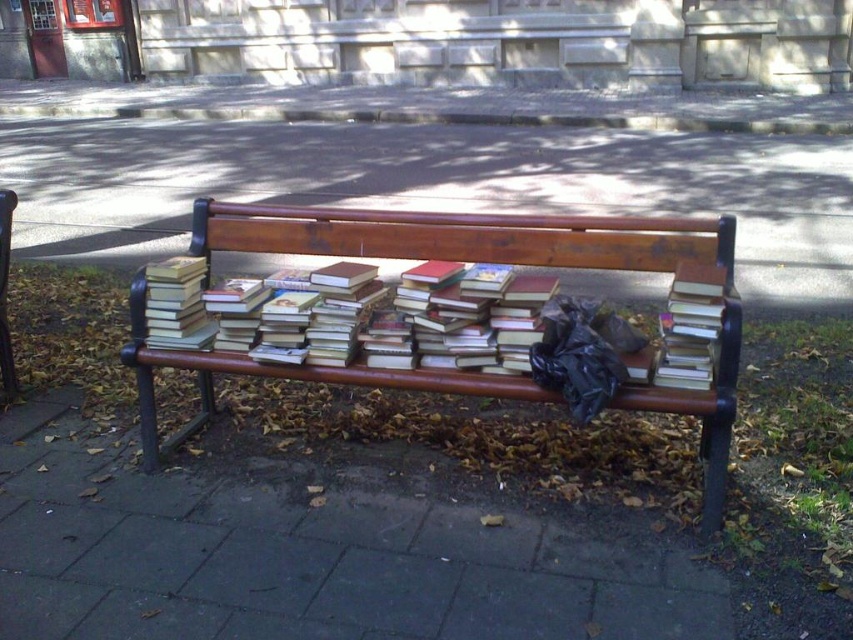
Which is above, brown wooden bench at center or wooden bench at center?

brown wooden bench at center is higher up.

Who is more forward, (643, 163) or (720, 392)?

Point (720, 392)

Locate an element on the screen. brown wooden bench at center is located at coordinates (434, 186).

Does hardcover books at center appear over hardcover book at center?

Yes.

Which is more to the left, hardcover books at center or hardcover book at center?

Positioned to the left is hardcover books at center.

Which is behind, point (274, 316) or point (695, 362)?

The point (274, 316) is more distant.

Where is `hardcover books at center`? hardcover books at center is located at coordinates (357, 316).

Between brown wooden bench at center and hardcover book at center, which one appears on the left side from the viewer's perspective?

brown wooden bench at center is more to the left.

Between brown wooden bench at center and hardcover book at center, which one is positioned lower?

hardcover book at center is below.

Which is behind, point (421, 184) or point (689, 369)?

The point (421, 184) is more distant.

The height and width of the screenshot is (640, 853). Find the location of `brown wooden bench at center`. brown wooden bench at center is located at coordinates (434, 186).